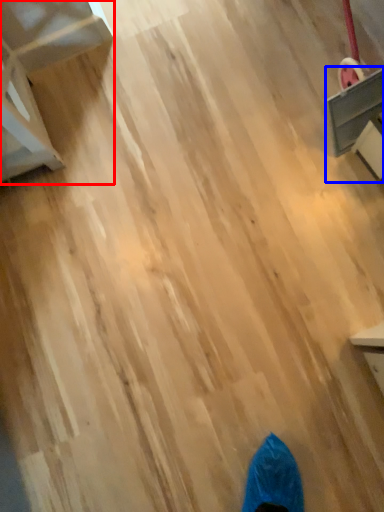
Question: Which point is further to the camera, furniture (highlighted by a red box) or furniture (highlighted by a blue box)?

Choices:
 (A) furniture
 (B) furniture

Answer: (B)